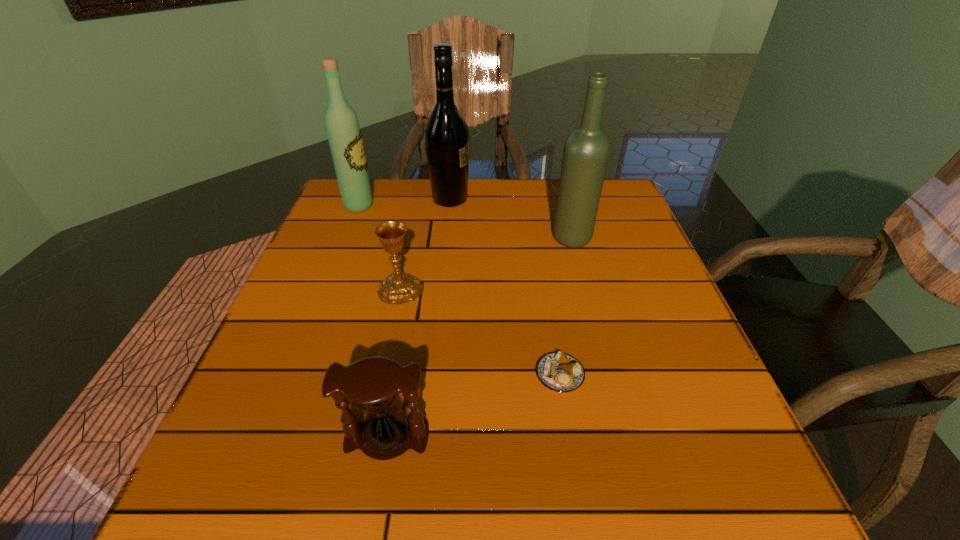
Locate an element on the screen. The height and width of the screenshot is (540, 960). the second wine bottle from left to right is located at coordinates (446, 133).

Locate an element on the screen. This screenshot has height=540, width=960. the nearest wine bottle is located at coordinates (586, 151).

Locate an element on the screen. This screenshot has height=540, width=960. the rightmost wine bottle is located at coordinates (586, 151).

Locate an element on the screen. The width and height of the screenshot is (960, 540). the leftmost wine bottle is located at coordinates (342, 126).

In order to click on hourglass in this screenshot , I will do `click(372, 385)`.

Find the location of a particular element. This screenshot has height=540, width=960. the fourth farthest object is located at coordinates (398, 288).

Where is `the shortest object`? This screenshot has width=960, height=540. the shortest object is located at coordinates (558, 371).

Where is `pastry`? The image size is (960, 540). pastry is located at coordinates (558, 371).

The image size is (960, 540). What are the coordinates of `blank space located on the label of the second wine bottle from left to right` in the screenshot? It's located at (535, 199).

Where is `blank space located on the right of the third farthest object`? Image resolution: width=960 pixels, height=540 pixels. blank space located on the right of the third farthest object is located at coordinates (624, 239).